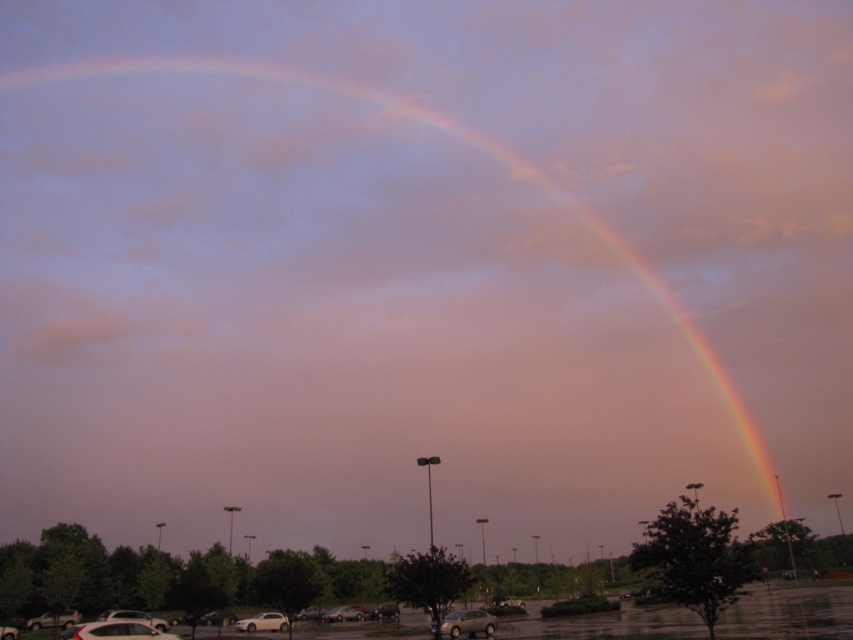
Question: Is silver metallic car at lower left smaller than matte silver sedan at center?

Choices:
 (A) yes
 (B) no

Answer: (B)

Question: Which point appears farthest from the camera in this image?

Choices:
 (A) (386, 609)
 (B) (148, 620)

Answer: (A)

Question: Is rainbow at upper center positioned in front of white glossy car at lower left?

Choices:
 (A) no
 (B) yes

Answer: (A)

Question: Which object appears closest to the camera in this image?

Choices:
 (A) white glossy car at lower left
 (B) white matte car at lower left

Answer: (A)

Question: Considering the real-world distances, which object is closest to the silver metallic sedan at center?

Choices:
 (A) satin silver sedan at lower center
 (B) metallic gray cars at lower center

Answer: (B)

Question: Is white matte car at lower left above matte silver sedan at center?

Choices:
 (A) no
 (B) yes

Answer: (B)